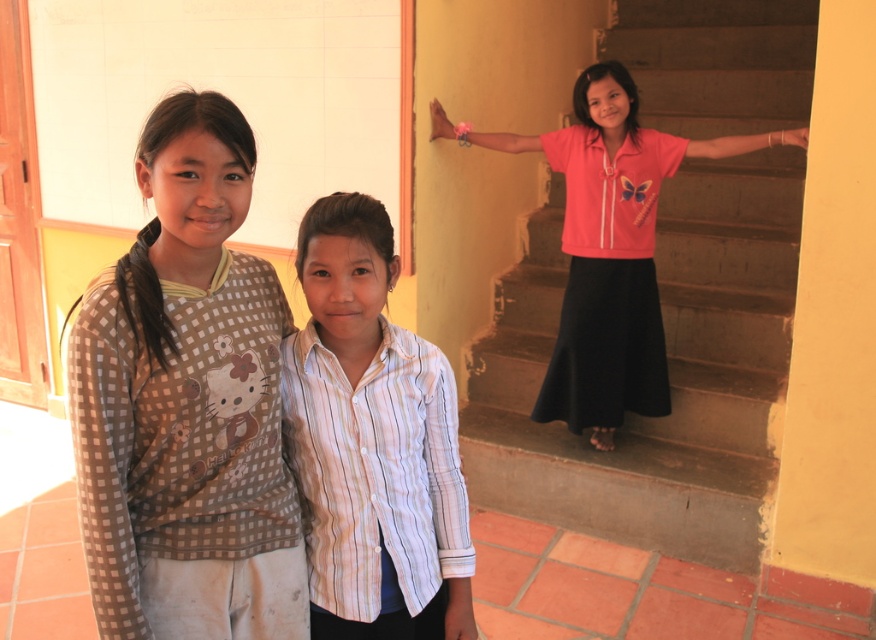
Which is more to the right, brown checkered shirt at left or pink satin blouse at upper right?

pink satin blouse at upper right is more to the right.

Between point (121, 392) and point (496, 140), which one is positioned in front?

Point (121, 392) is in front.

I want to click on brown checkered shirt at left, so click(186, 403).

Does brown checkered shirt at left appear under white striped shirt at center?

No.

Between point (195, 429) and point (351, 628), which one is positioned in front?

Point (195, 429) is more forward.

The height and width of the screenshot is (640, 876). I want to click on brown checkered shirt at left, so click(186, 403).

Who is higher up, white striped shirt at center or pink satin blouse at upper right?

pink satin blouse at upper right is above.

Does white striped shirt at center have a smaller size compared to pink satin blouse at upper right?

Incorrect, white striped shirt at center is not smaller in size than pink satin blouse at upper right.

Where is `white striped shirt at center`? white striped shirt at center is located at coordinates point(372,442).